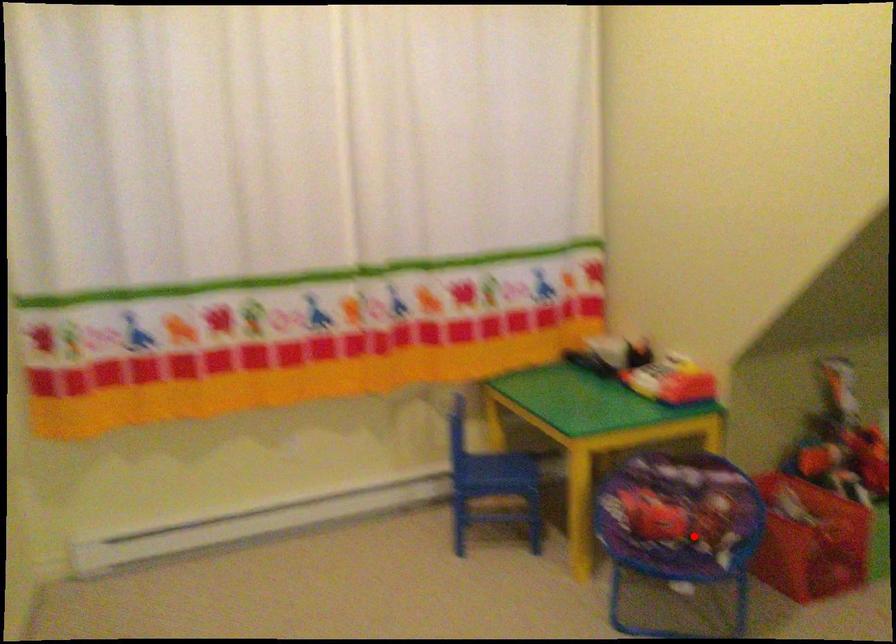
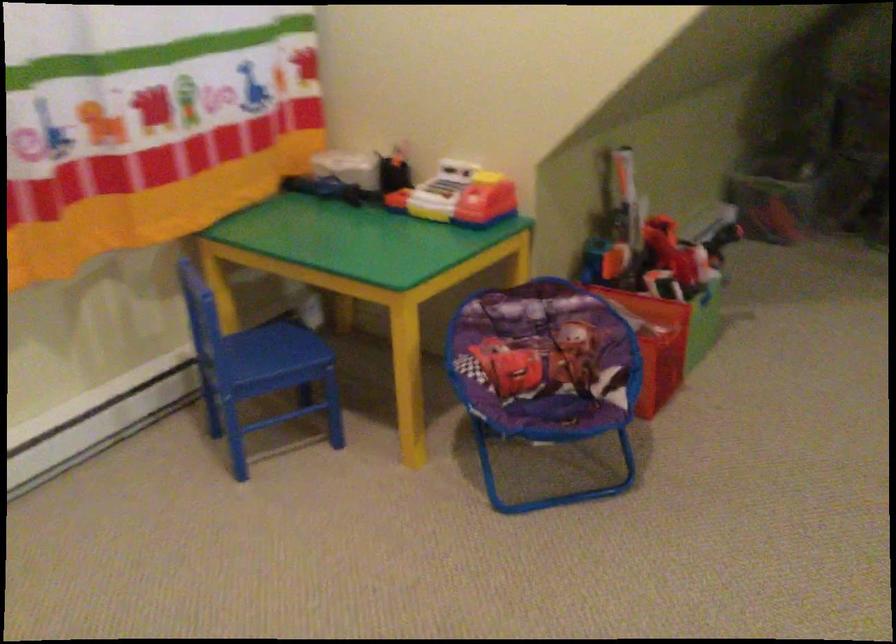
Question: I am providing you with two images of the same scene from different viewpoints. A red point is marked on the first image. Can you still see the location of the red point in image 2?

Choices:
 (A) Yes
 (B) No

Answer: (A)